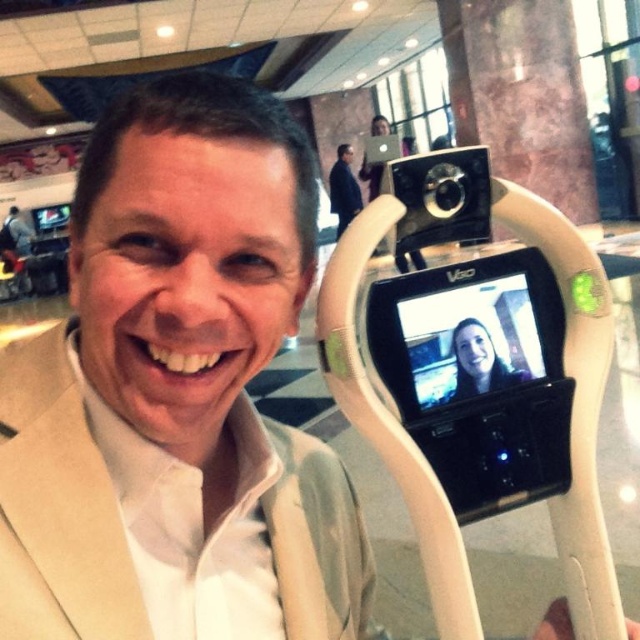
Does black plastic camera at upper center have a greater width compared to black matte suit at upper center?

In fact, black plastic camera at upper center might be narrower than black matte suit at upper center.

Is point (483, 166) farther from viewer compared to point (344, 196)?

No, (483, 166) is in front of (344, 196).

The width and height of the screenshot is (640, 640). What do you see at coordinates (440, 196) in the screenshot? I see `black plastic camera at upper center` at bounding box center [440, 196].

Identify the location of black plastic camera at upper center. The width and height of the screenshot is (640, 640). (440, 196).